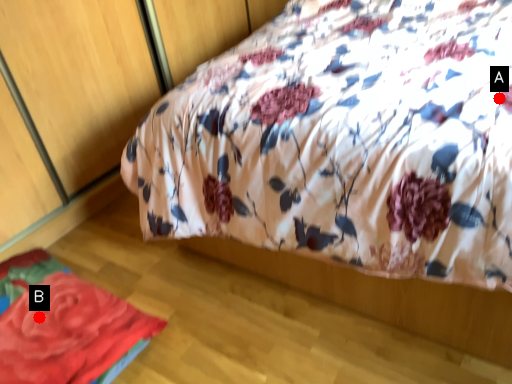
Question: Two points are circled on the image, labeled by A and B beside each circle. Which point appears farthest from the camera in this image?

Choices:
 (A) A is further
 (B) B is further

Answer: (B)